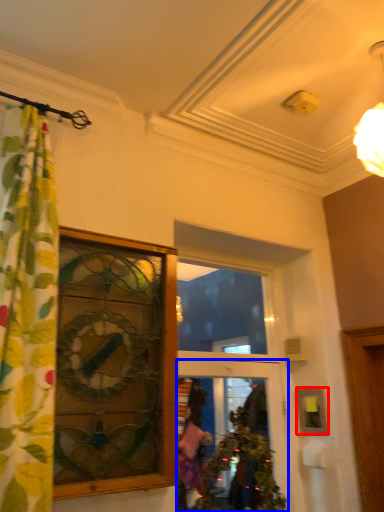
Question: Which point is closer to the camera, picture frame (highlighted by a red box) or door (highlighted by a blue box)?

Choices:
 (A) picture frame
 (B) door

Answer: (B)